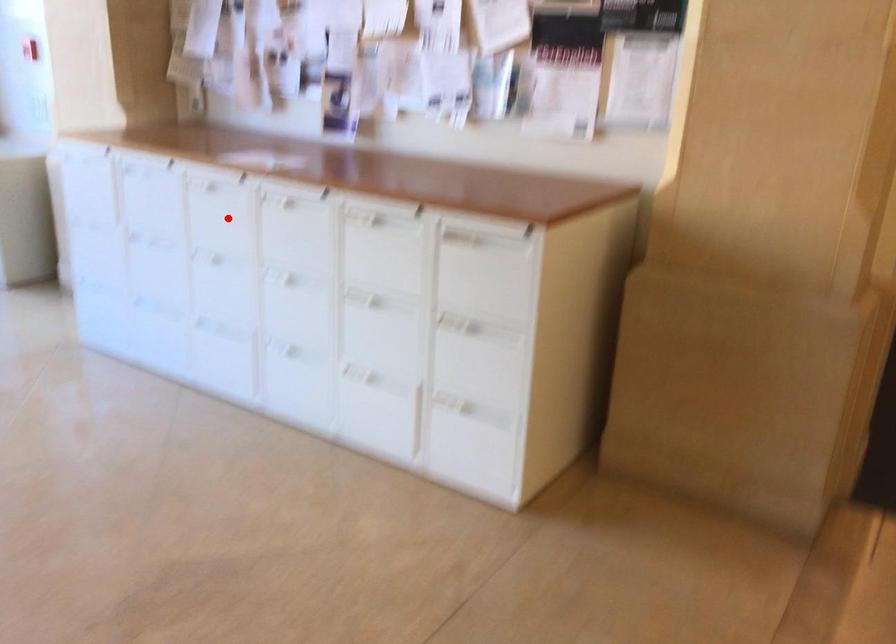
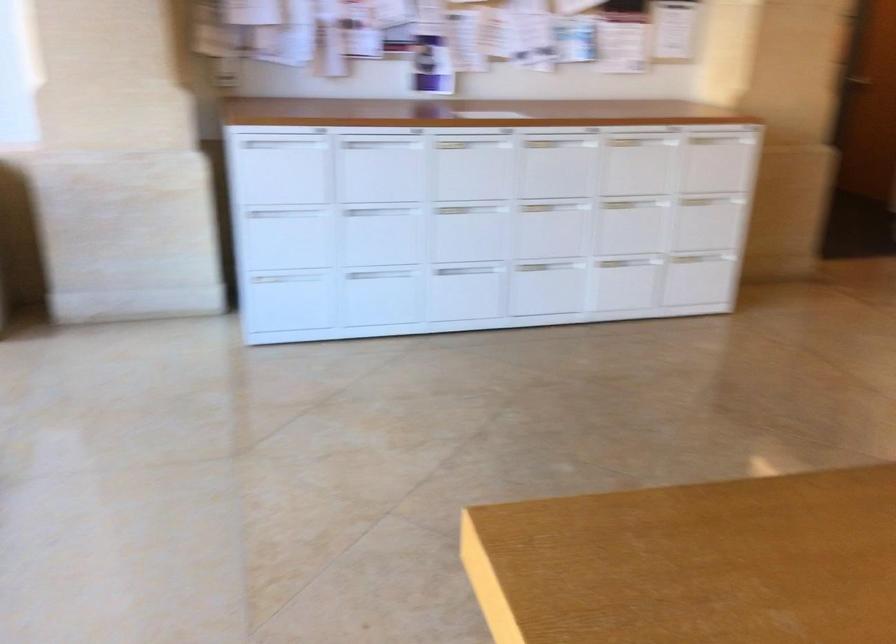
Find the pixel in the second image that matches the highlighted location in the first image.

(471, 167)